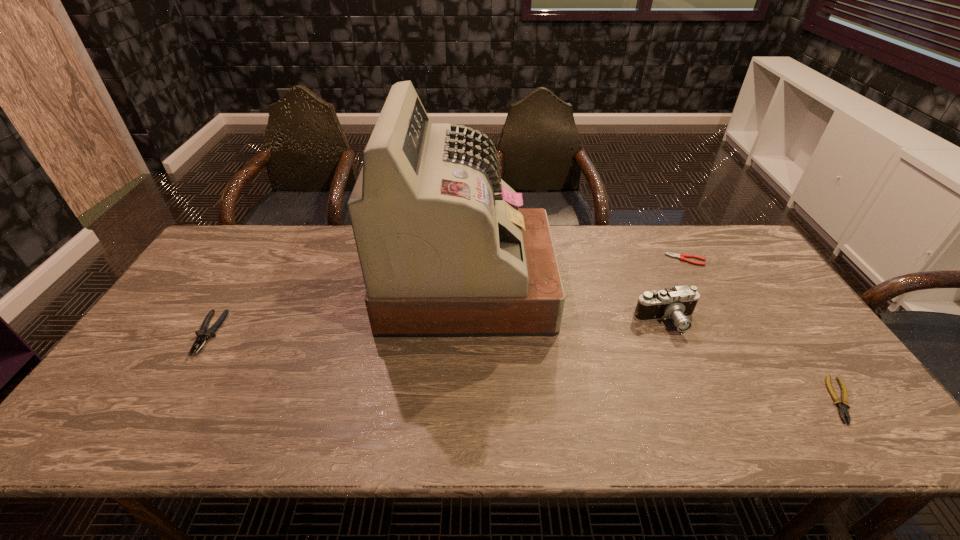
Where is `the tallest object`? The height and width of the screenshot is (540, 960). the tallest object is located at coordinates (445, 251).

At what (x,y) coordinates should I click in order to perform the action: click on the fourth object from right to left. Please return your answer as a coordinate pair (x, y). Looking at the image, I should click on (445, 251).

The image size is (960, 540). In order to click on the fourth shortest object in this screenshot , I will do `click(678, 303)`.

Identify the location of camera. (678, 303).

Find the location of `the leftmost pliers`. the leftmost pliers is located at coordinates (204, 334).

Locate an element on the screen. the second nearest pliers is located at coordinates (204, 334).

Where is `the second pliers from left to right`? the second pliers from left to right is located at coordinates click(x=681, y=256).

Find the location of a particular element. The width and height of the screenshot is (960, 540). the farthest pliers is located at coordinates [681, 256].

The height and width of the screenshot is (540, 960). I want to click on the nearest object, so click(842, 404).

You are a GUI agent. You are given a task and a screenshot of the screen. Output one action in this format:
    pyautogui.click(x=<x>, y=<y>)
    Task: Click on the rightmost pliers
    
    Given the screenshot: What is the action you would take?
    pyautogui.click(x=842, y=404)